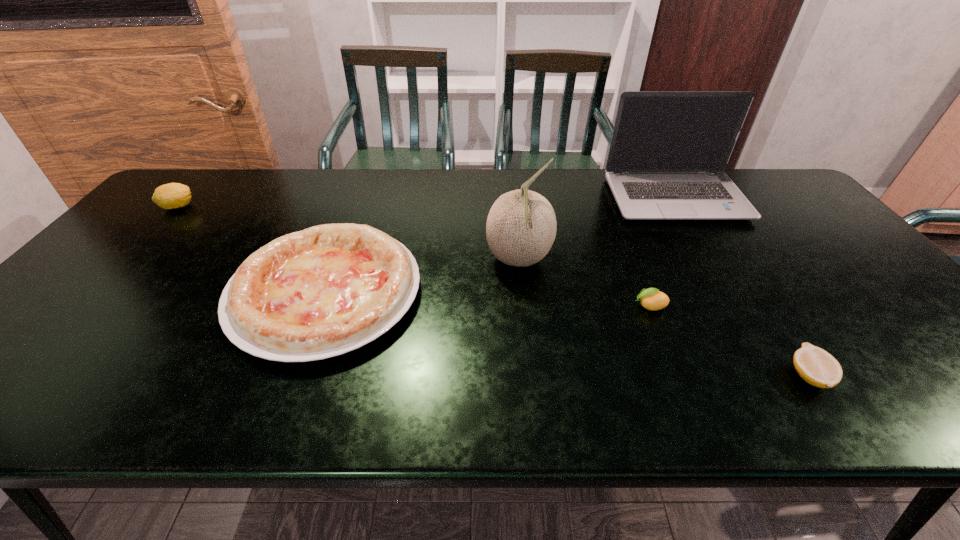
Locate an element on the screen. free location that satisfies the following two spatial constraints: 1. at the stem end of the farthest lemon; 2. on the right side of the third object from left to right is located at coordinates (129, 260).

Locate an element on the screen. free region that satisfies the following two spatial constraints: 1. on the screen of the laptop computer; 2. at the stem end of the tallest lemon is located at coordinates (681, 207).

The image size is (960, 540). I want to click on vacant region that satisfies the following two spatial constraints: 1. with leaves positioned above the rightmost lemon; 2. on the left side of the second lemon from right to left, so click(x=678, y=376).

The width and height of the screenshot is (960, 540). I want to click on free space that satisfies the following two spatial constraints: 1. with leaves positioned above the rightmost lemon; 2. on the left side of the second lemon from left to right, so click(678, 376).

Locate an element on the screen. This screenshot has width=960, height=540. vacant space that satisfies the following two spatial constraints: 1. on the screen of the laptop computer; 2. with leaves positioned above the second lemon from right to left is located at coordinates (741, 306).

You are a GUI agent. You are given a task and a screenshot of the screen. Output one action in this format:
    pyautogui.click(x=<x>, y=<y>)
    Task: Click on the vacant area in the image that satisfies the following two spatial constraints: 1. with leaves positioned above the second lemon from right to left; 2. on the left side of the rightmost lemon
    
    Given the screenshot: What is the action you would take?
    pyautogui.click(x=678, y=376)

This screenshot has width=960, height=540. Find the location of `free space that satisfies the following two spatial constraints: 1. at the stem end of the tallest lemon; 2. on the back side of the pizza`. free space that satisfies the following two spatial constraints: 1. at the stem end of the tallest lemon; 2. on the back side of the pizza is located at coordinates (98, 293).